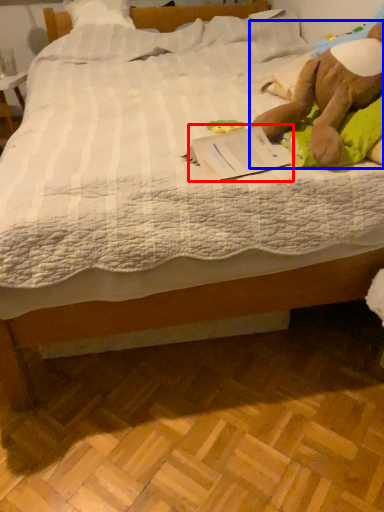
Question: Among these objects, which one is nearest to the camera, paperback book (highlighted by a red box) or animal (highlighted by a blue box)?

Choices:
 (A) paperback book
 (B) animal

Answer: (B)